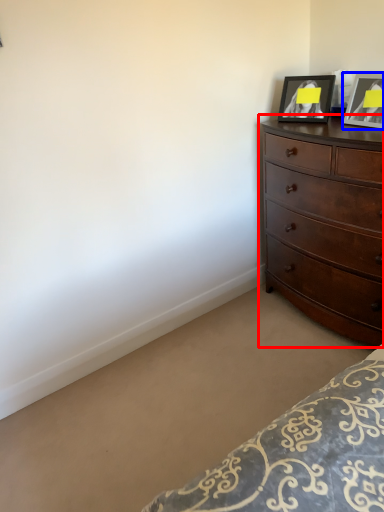
Question: Which object appears closest to the camera in this image, chest of drawers (highlighted by a red box) or picture frame (highlighted by a blue box)?

Choices:
 (A) chest of drawers
 (B) picture frame

Answer: (A)